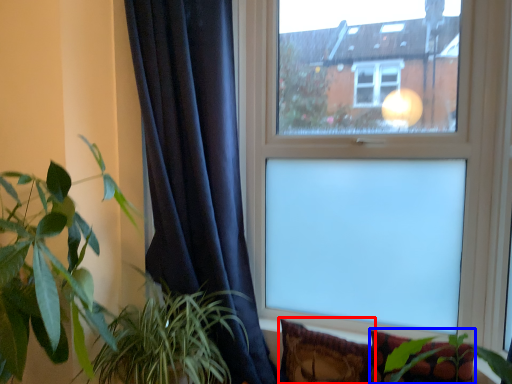
Question: Which object is further to the camera taking this photo, pillow (highlighted by a red box) or pillow (highlighted by a blue box)?

Choices:
 (A) pillow
 (B) pillow

Answer: (A)